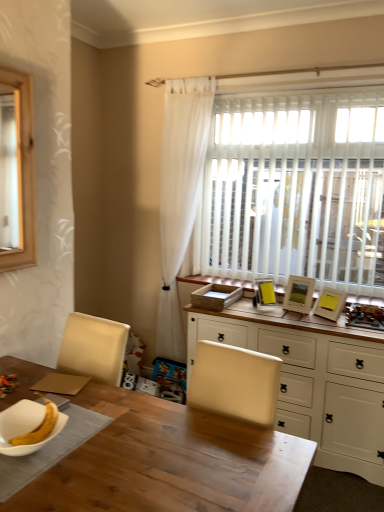
Where is `vacant region above wooden table at center (from a real-world perspective)`? Image resolution: width=384 pixels, height=512 pixels. vacant region above wooden table at center (from a real-world perspective) is located at coordinates (123, 428).